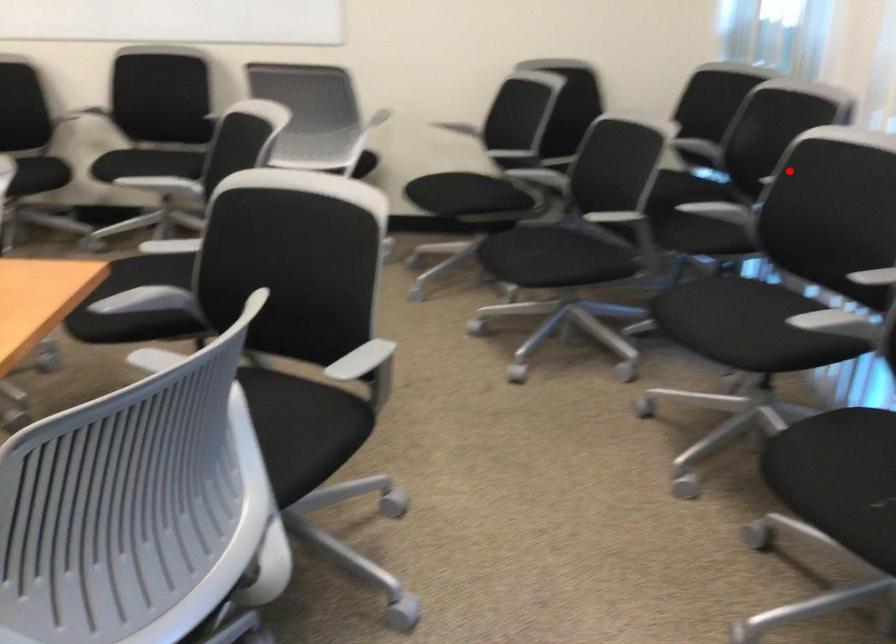
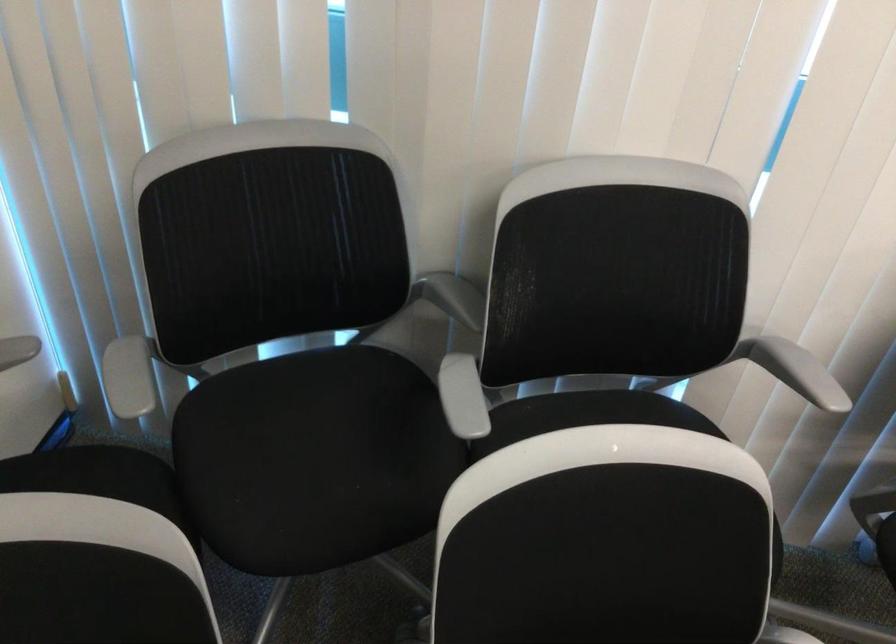
Find the pixel in the second image that matches the highlighted location in the first image.

(794, 370)